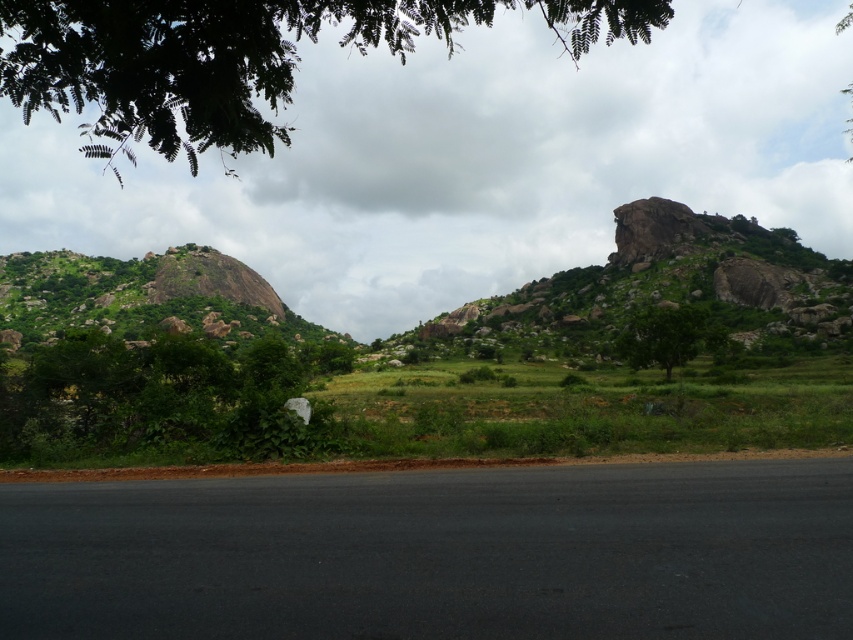
You are a hiker planning to walk from the green leafy tree at lower left to the green rocky mountain at left. Based on their sizes, which one do you think is closer to you?

The green leafy tree at lower left occupies less space than the green rocky mountain at left, so it is likely closer since smaller objects can appear closer if they are actually nearer or larger objects farther away. However, without additional depth cues, it is challenging to determine definitively based solely on size.

You are a hiker planning to take a photo of both the green leafy tree at upper left and the green rocky mountain at left in the same frame. Based on the scene description, can you determine if both objects will fit in your camera viewfinder at the same time?

The green leafy tree at upper left and the green rocky mountain at left are 40.94 meters apart from each other. Since the distance between them is 40.94 meters, it depends on the camera lens used. A wide angle lens could potentially capture both in the same frame, but a standard or telephoto lens might not. However, without knowing the camera sensor size or focal length, it is difficult to give a definitive answer. But according to the scene description, the tree and mountain are positioned on the left side